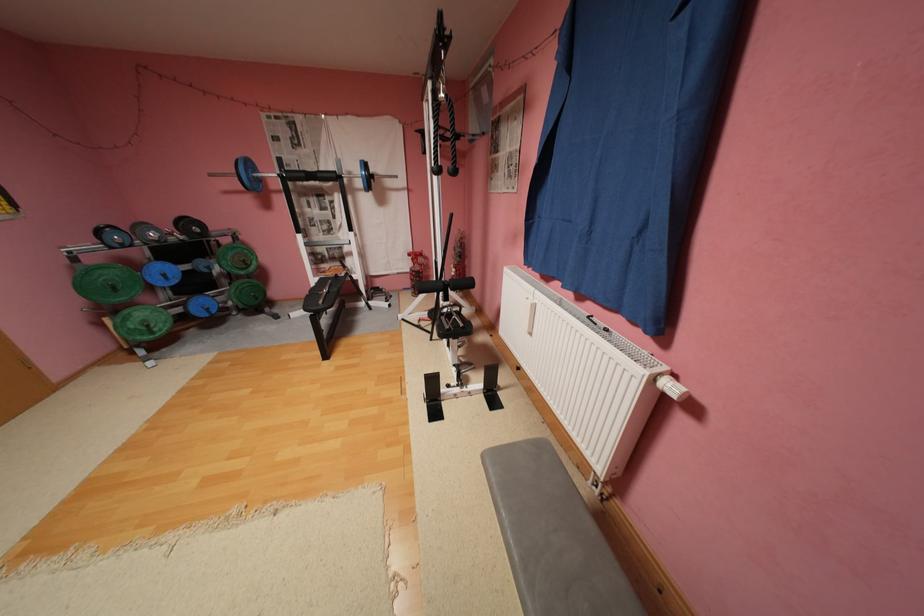
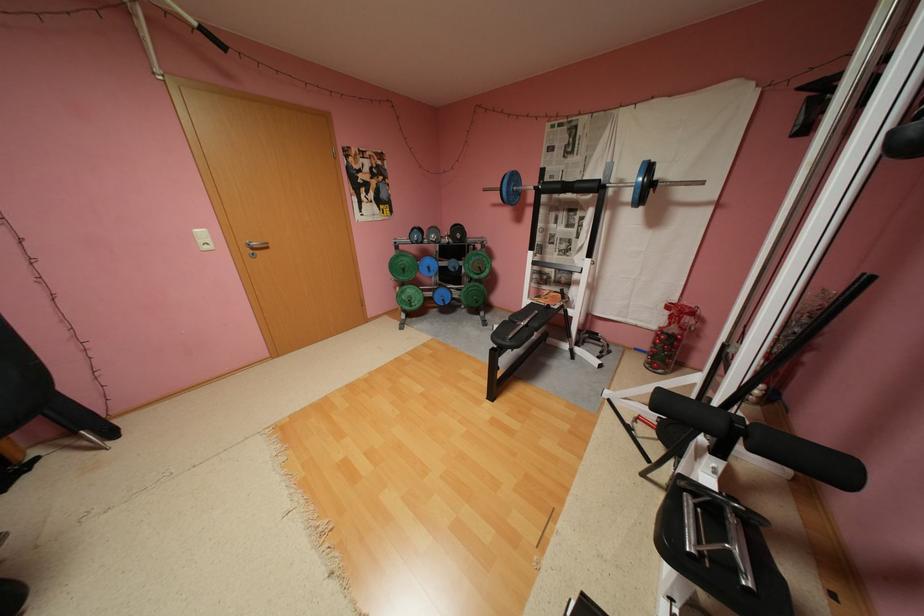
Locate, in the second image, the point that corresponds to the point at 178,276 in the first image.

(441, 269)